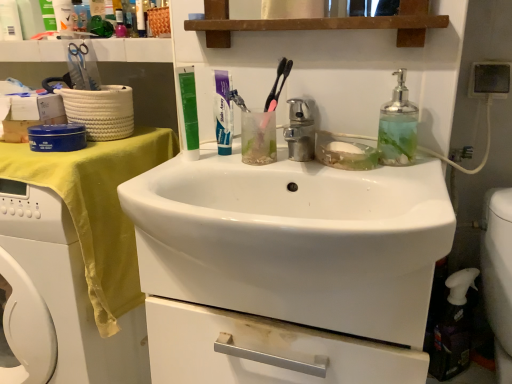
Identify the location of vacant area that is in front of clear glass soap dispenser at right. (409, 184).